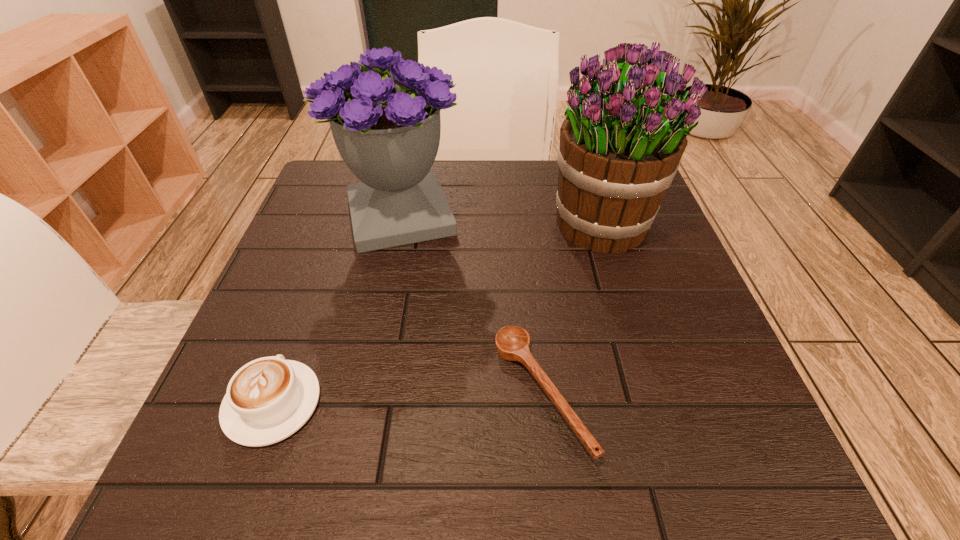
Where is `vacant space in between the shortest object and the left bouquet`? This screenshot has height=540, width=960. vacant space in between the shortest object and the left bouquet is located at coordinates (470, 305).

At what (x,y) coordinates should I click in order to perform the action: click on empty space between the wooden spoon and the left bouquet. Please return your answer as a coordinate pair (x, y). Looking at the image, I should click on (470, 305).

Find the location of a particular element. free space that is in between the left bouquet and the cappuccino is located at coordinates (336, 309).

The height and width of the screenshot is (540, 960). I want to click on object that is the closest to the right bouquet, so click(512, 342).

This screenshot has width=960, height=540. Find the location of `the closest object to the left bouquet`. the closest object to the left bouquet is located at coordinates (621, 143).

What are the coordinates of `free point that satisfies the following two spatial constraints: 1. with the handle on the right side of the right bouquet; 2. on the right side of the third tallest object` in the screenshot? It's located at (338, 225).

You are a GUI agent. You are given a task and a screenshot of the screen. Output one action in this format:
    pyautogui.click(x=<x>, y=<y>)
    Task: Click on the free space that satisfies the following two spatial constraints: 1. on the front side of the left bouquet; 2. on the right side of the right bouquet
    Image resolution: width=960 pixels, height=540 pixels.
    Given the screenshot: What is the action you would take?
    pyautogui.click(x=398, y=225)

The image size is (960, 540). I want to click on blank area in the image that satisfies the following two spatial constraints: 1. with the handle on the right side of the right bouquet; 2. on the right side of the second shortest object, so click(x=338, y=225).

Identify the location of vacant space that satisfies the following two spatial constraints: 1. with the handle on the right side of the left bouquet; 2. on the left side of the cappuccino. This screenshot has height=540, width=960. (341, 216).

Locate an element on the screen. blank space that satisfies the following two spatial constraints: 1. with the handle on the right side of the left bouquet; 2. on the right side of the cappuccino is located at coordinates (341, 216).